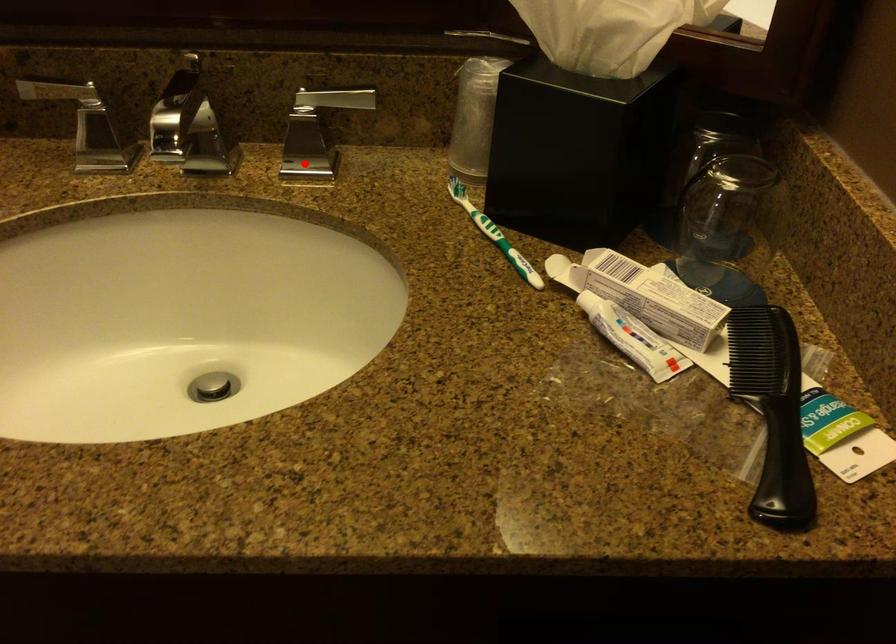
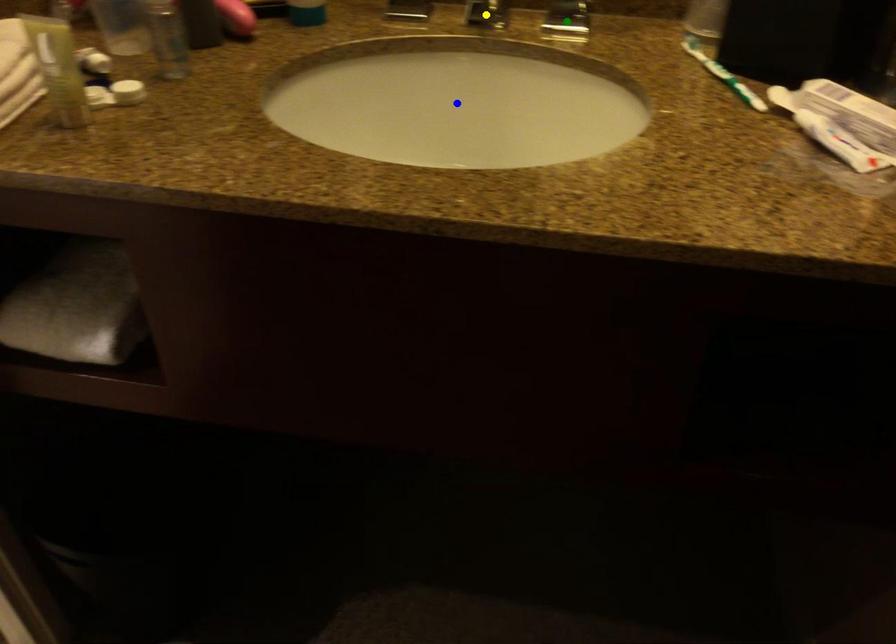
Question: I am providing you with two images of the same scene from different viewpoints. A red point is marked on the first image. You are given multiple points on the second image. Can you choose the point in image 2 that corresponds to the point in image 1?

Choices:
 (A) yellow point
 (B) blue point
 (C) green point

Answer: (C)